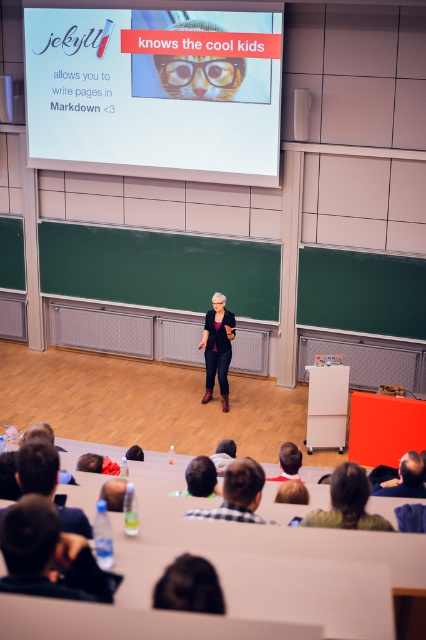
Does dark brown hair at lower left lie in front of matte black blazer at center?

That is True.

Who is positioned more to the right, dark brown hair at lower left or matte black blazer at center?

matte black blazer at center

What do you see at coordinates (37, 467) in the screenshot?
I see `dark brown hair at lower left` at bounding box center [37, 467].

This screenshot has width=426, height=640. What are the coordinates of `dark brown hair at lower left` in the screenshot? It's located at (37, 467).

Is plaid shirt at lower center further to camera compared to dark brown leather jacket at lower right?

No, plaid shirt at lower center is closer to the viewer.

Is point (196, 515) closer to viewer compared to point (411, 483)?

Yes, it is.

What are the coordinates of `plaid shirt at lower center` in the screenshot? It's located at (238, 493).

Is white matte projection screen at upper center positioned before black leather jacket at lower left?

That is False.

This screenshot has height=640, width=426. What are the coordinates of `white matte projection screen at upper center` in the screenshot? It's located at (155, 92).